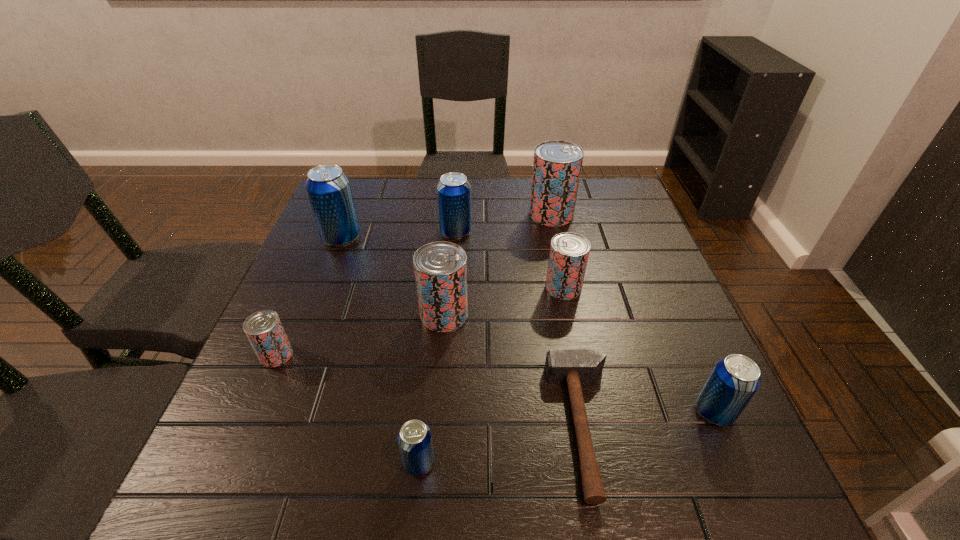
In order to click on blank area at the right edge in this screenshot , I will do `click(634, 375)`.

Find the location of a particular element. free space at the far left corner of the desktop is located at coordinates (384, 180).

In order to click on vacant space at the far right corner in this screenshot , I will do `click(597, 183)`.

Locate an element on the screen. The image size is (960, 540). vacant area that lies between the third smallest blue beer can and the rightmost blue beer can is located at coordinates (586, 322).

The height and width of the screenshot is (540, 960). What are the coordinates of `free space between the third smallest blue beer can and the biggest red beer can` in the screenshot? It's located at [x=503, y=224].

Where is `free point between the third smallest blue beer can and the smallest blue beer can`? The width and height of the screenshot is (960, 540). free point between the third smallest blue beer can and the smallest blue beer can is located at coordinates (438, 347).

I want to click on free space between the smallest blue beer can and the second red beer can from left to right, so click(432, 389).

This screenshot has height=540, width=960. Find the location of `blank region between the second red beer can from left to right and the third biggest red beer can`. blank region between the second red beer can from left to right and the third biggest red beer can is located at coordinates (504, 301).

I want to click on free space between the third biggest red beer can and the nearest blue beer can, so click(x=492, y=375).

Identify the location of free space between the second smallest red beer can and the nearest beer can. The height and width of the screenshot is (540, 960). (492, 375).